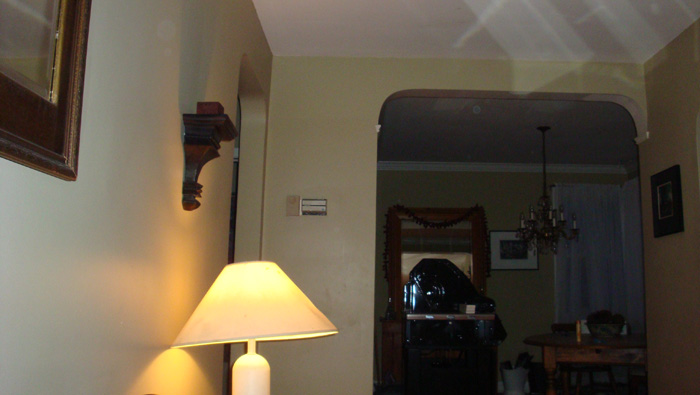
At what (x,y) coordinates should I click in order to perform the action: click on mirror. Please return your answer as a coordinate pair (x, y). The height and width of the screenshot is (395, 700). Looking at the image, I should click on (446, 222).